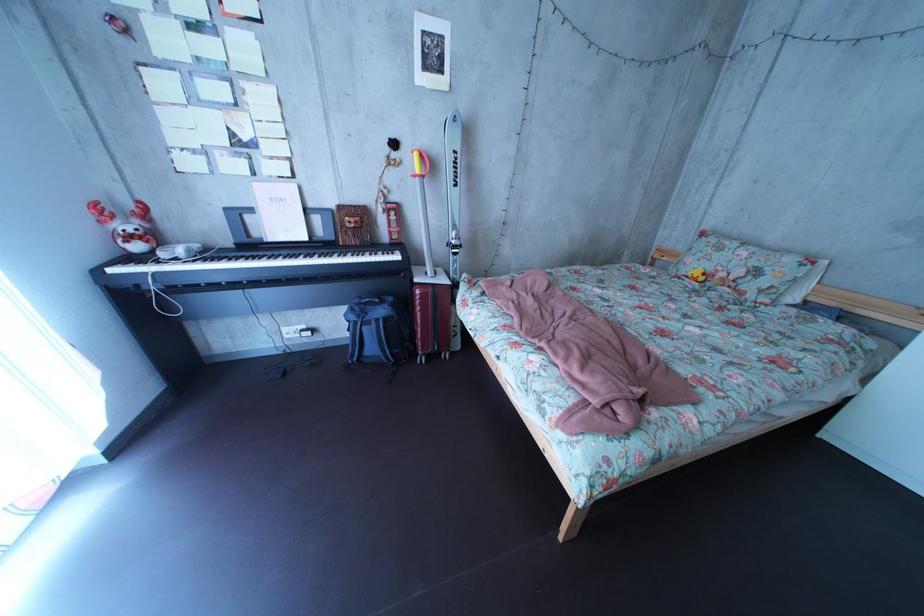
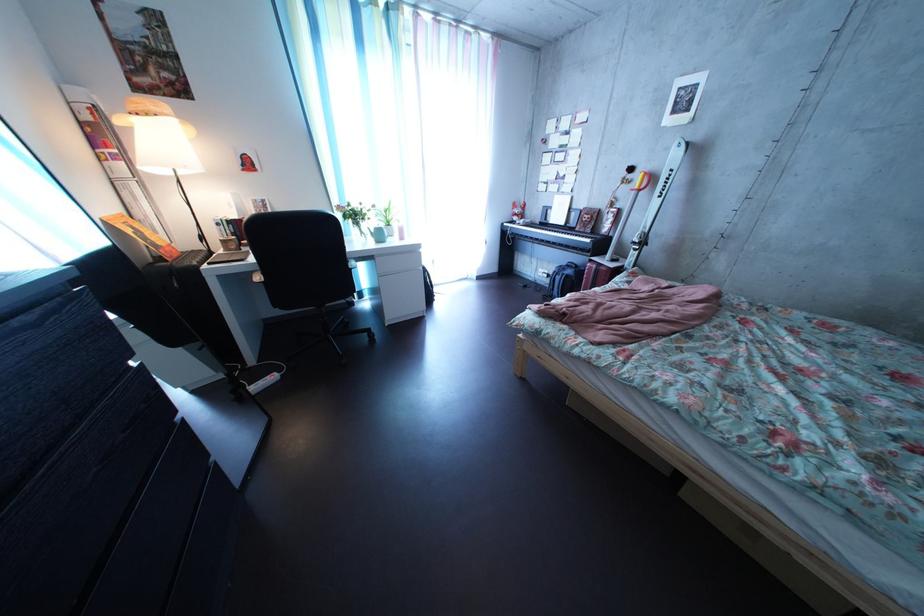
The point at (321,246) is marked in the first image. Where is the corresponding point in the second image?

(577, 232)